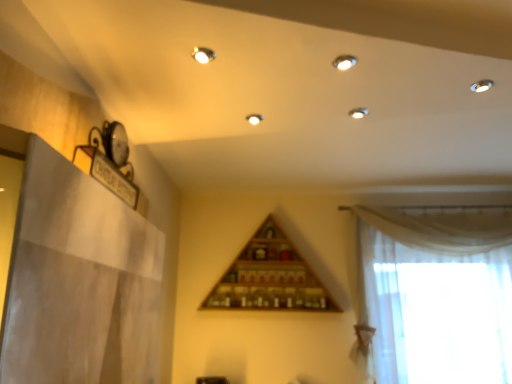
The height and width of the screenshot is (384, 512). Identify the location of white sheer curtain at right. (438, 295).

This screenshot has height=384, width=512. Describe the element at coordinates (438, 295) in the screenshot. I see `white sheer curtain at right` at that location.

You are a GUI agent. You are given a task and a screenshot of the screen. Output one action in this format:
    pyautogui.click(x=<x>, y=<y>)
    Task: Click on the wooden triangle at center
    
    Given the screenshot: What is the action you would take?
    pyautogui.click(x=270, y=277)

This screenshot has width=512, height=384. What do you see at coordinates (270, 277) in the screenshot? I see `wooden triangle at center` at bounding box center [270, 277].

You are a GUI agent. You are given a task and a screenshot of the screen. Output one action in this format:
    pyautogui.click(x=<x>, y=<y>)
    Task: Click on the white sheer curtain at right
    
    Given the screenshot: What is the action you would take?
    pyautogui.click(x=438, y=295)

Between wooden triangle at center and white sheer curtain at right, which one appears on the right side from the viewer's perspective?

white sheer curtain at right.

Which object is further away from the camera, wooden triangle at center or white sheer curtain at right?

wooden triangle at center is more distant.

Which is in front, point (290, 285) or point (383, 347)?

Positioned in front is point (383, 347).

From the image's perspective, who appears lower, wooden triangle at center or white sheer curtain at right?

A: white sheer curtain at right is shown below in the image.

From a real-world perspective, is wooden triangle at center over white sheer curtain at right?

Indeed, from a real-world perspective, wooden triangle at center stands above white sheer curtain at right.

Which object is thinner, wooden triangle at center or white sheer curtain at right?

white sheer curtain at right is thinner.

From their relative heights in the image, would you say wooden triangle at center is taller or shorter than white sheer curtain at right?

Result: wooden triangle at center is shorter than white sheer curtain at right.

Considering the sizes of wooden triangle at center and white sheer curtain at right in the image, is wooden triangle at center bigger or smaller than white sheer curtain at right?

wooden triangle at center is smaller than white sheer curtain at right.

Based on the photo, is wooden triangle at center outside of white sheer curtain at right?

Yes, wooden triangle at center is outside of white sheer curtain at right.

Is wooden triangle at center placed right next to white sheer curtain at right?

No, wooden triangle at center is not beside white sheer curtain at right.

Does wooden triangle at center turn towards white sheer curtain at right?

No, wooden triangle at center is not oriented towards white sheer curtain at right.

At what (x,y) coordinates should I click in order to perform the action: click on curtain on the right of wooden triangle at center. Please return your answer as a coordinate pair (x, y). Looking at the image, I should click on (438, 295).

Does white sheer curtain at right appear on the right side of wooden triangle at center?

Yes, white sheer curtain at right is to the right of wooden triangle at center.

Which is behind, white sheer curtain at right or wooden triangle at center?

wooden triangle at center is further from the camera.

Does point (390, 225) come farther from viewer compared to point (309, 308)?

Yes.

From the image's perspective, which is below, white sheer curtain at right or wooden triangle at center?

white sheer curtain at right.

From a real-world perspective, is white sheer curtain at right above or below wooden triangle at center?

white sheer curtain at right is situated lower than wooden triangle at center in the real world.

Which of these two, white sheer curtain at right or wooden triangle at center, is thinner?

With smaller width is white sheer curtain at right.

Between white sheer curtain at right and wooden triangle at center, which one has less height?

Standing shorter between the two is wooden triangle at center.

Can you confirm if white sheer curtain at right is bigger than wooden triangle at center?

Yes, white sheer curtain at right is bigger than wooden triangle at center.

Would you say white sheer curtain at right is outside wooden triangle at center?

white sheer curtain at right lies outside wooden triangle at center's area.

Looking at this image, are white sheer curtain at right and wooden triangle at center making contact?

No, white sheer curtain at right is not next to wooden triangle at center.

Is white sheer curtain at right turned away from wooden triangle at center?

No, white sheer curtain at right's orientation is not away from wooden triangle at center.

How different are the orientations of white sheer curtain at right and wooden triangle at center in degrees?

The angle between the facing direction of white sheer curtain at right and the facing direction of wooden triangle at center is 1.08 degrees.

Measure the distance from white sheer curtain at right to wooden triangle at center.

white sheer curtain at right and wooden triangle at center are 27.33 inches apart.

Where is `curtain on the right of wooden triangle at center`? The height and width of the screenshot is (384, 512). curtain on the right of wooden triangle at center is located at coordinates (438, 295).

At what (x,y) coordinates should I click in order to perform the action: click on shelf above the white sheer curtain at right (from the image's perspective). Please return your answer as a coordinate pair (x, y). This screenshot has width=512, height=384. Looking at the image, I should click on (270, 277).

Identify the location of shelf above the white sheer curtain at right (from a real-world perspective). This screenshot has width=512, height=384. (270, 277).